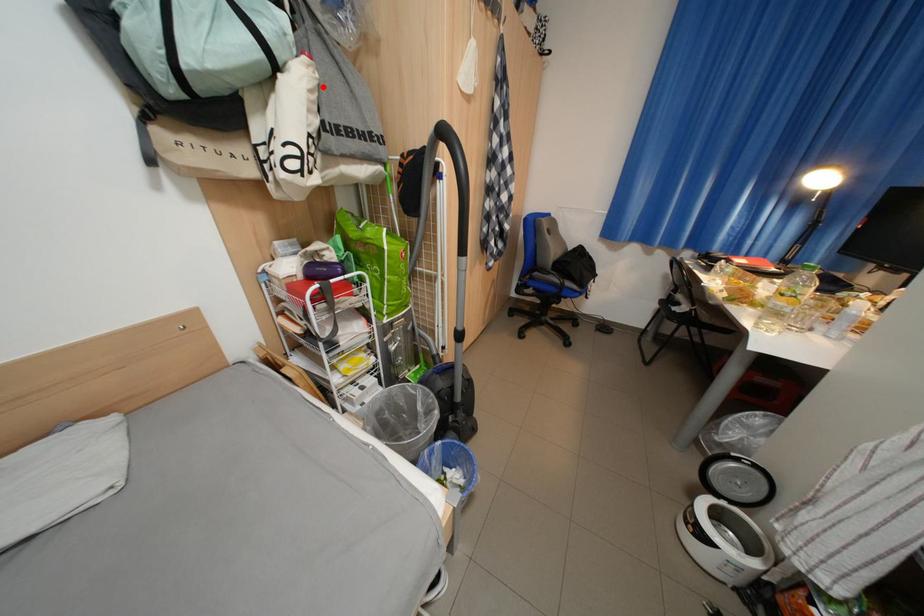
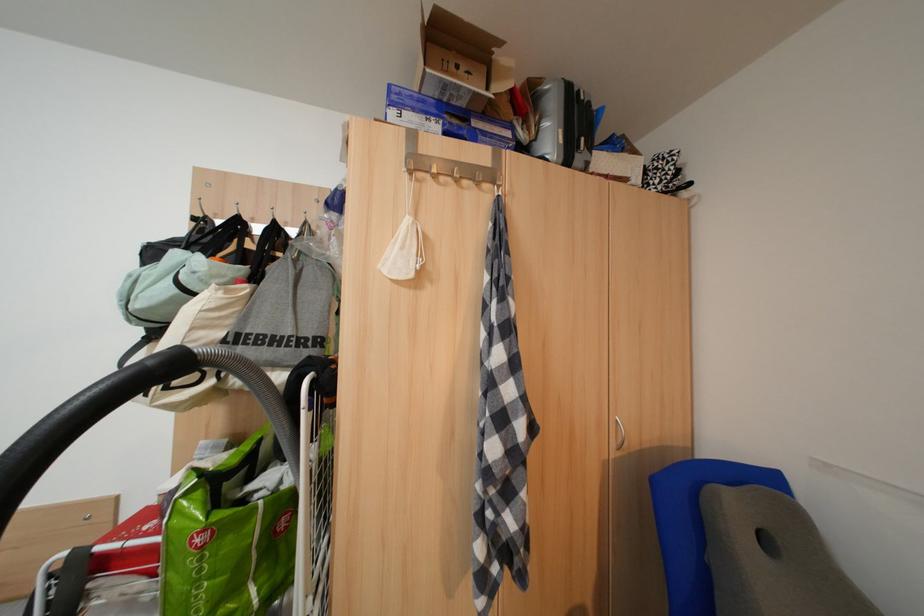
In the second image, find the point that corresponds to the highlighted location in the first image.

(224, 307)